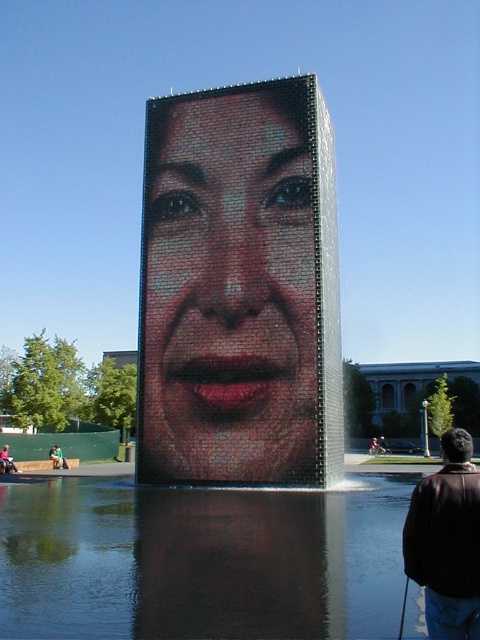
Question: Which of the following is the closest to the observer?

Choices:
 (A) brown leather jacket at lower right
 (B) smooth mosaic face at center
 (C) transparent glass water at center

Answer: (A)

Question: Which point is closer to the camera?

Choices:
 (A) smooth mosaic face at center
 (B) transparent glass water at center

Answer: (B)

Question: Can you confirm if smooth mosaic face at center is positioned above brown leather jacket at lower right?

Choices:
 (A) yes
 (B) no

Answer: (A)

Question: Where is transparent glass water at center located in relation to brown leather jacket at lower right in the image?

Choices:
 (A) below
 (B) above

Answer: (A)

Question: Estimate the real-world distances between objects in this image. Which object is closer to the transparent glass water at center?

Choices:
 (A) brown leather jacket at lower right
 (B) smooth mosaic face at center

Answer: (A)

Question: Is smooth mosaic face at center wider than transparent glass water at center?

Choices:
 (A) yes
 (B) no

Answer: (B)